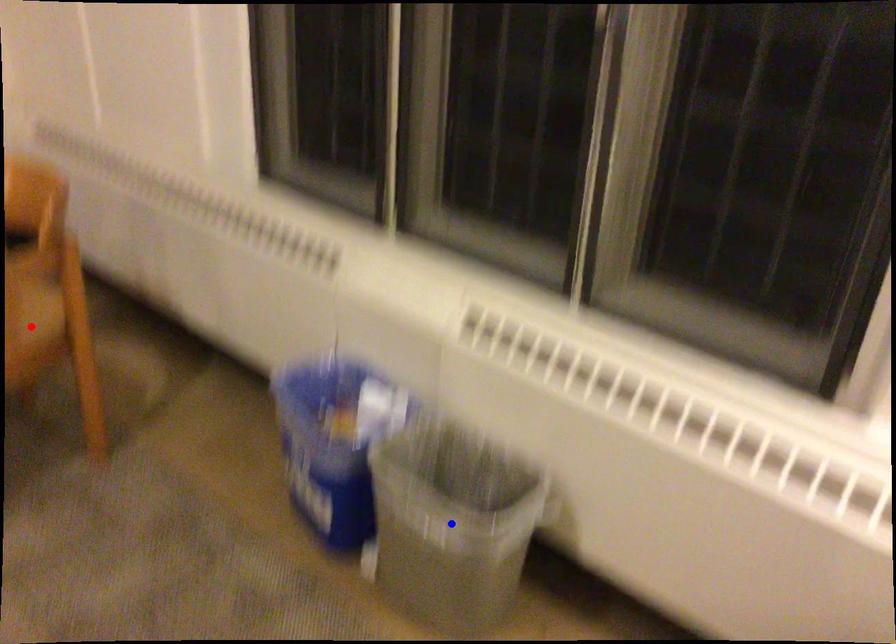
Question: Which of the two points in the image is closer to the camera?

Choices:
 (A) Blue point is closer.
 (B) Red point is closer.

Answer: (A)